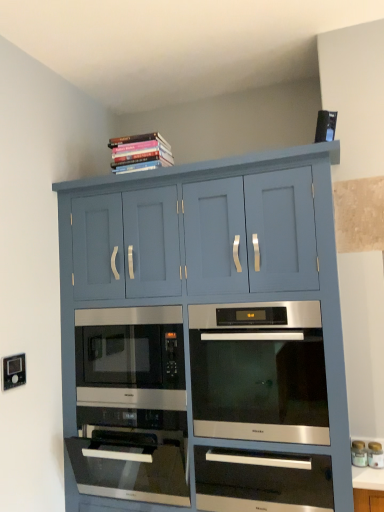
Question: Is white plastic electric outlet at lower left far from matte blue cabinet at upper center?

Choices:
 (A) no
 (B) yes

Answer: (A)

Question: Is white plastic electric outlet at lower left surrounding matte blue cabinet at upper center?

Choices:
 (A) no
 (B) yes

Answer: (A)

Question: Does white plastic electric outlet at lower left have a greater height compared to matte blue cabinet at upper center?

Choices:
 (A) no
 (B) yes

Answer: (A)

Question: Is white plastic electric outlet at lower left facing towards matte blue cabinet at upper center?

Choices:
 (A) no
 (B) yes

Answer: (A)

Question: Is white plastic electric outlet at lower left not inside matte blue cabinet at upper center?

Choices:
 (A) no
 (B) yes

Answer: (B)

Question: Is white plastic electric outlet at lower left to the left of matte blue cabinet at upper center from the viewer's perspective?

Choices:
 (A) no
 (B) yes

Answer: (B)

Question: Is matte blue cabinet at upper center turned away from white glossy jar at lower right, which is the 1th appliance from left to right?

Choices:
 (A) no
 (B) yes

Answer: (A)

Question: Is matte blue cabinet at upper center with white glossy jar at lower right, which is the 1th appliance from left to right?

Choices:
 (A) no
 (B) yes

Answer: (A)

Question: Is matte blue cabinet at upper center positioned in front of white glossy jar at lower right, which is the 1th appliance from left to right?

Choices:
 (A) no
 (B) yes

Answer: (B)

Question: Can you confirm if matte blue cabinet at upper center is thinner than white glossy jar at lower right, positioned as the 2th appliance in right-to-left order?

Choices:
 (A) no
 (B) yes

Answer: (A)

Question: Is matte blue cabinet at upper center shorter than white glossy jar at lower right, positioned as the 2th appliance in right-to-left order?

Choices:
 (A) yes
 (B) no

Answer: (B)

Question: Does matte blue cabinet at upper center contain white glossy jar at lower right, positioned as the 2th appliance in right-to-left order?

Choices:
 (A) yes
 (B) no

Answer: (A)

Question: Does white glossy jar at lower right, which is the 1th appliance from left to right, come behind satin silver drawer at center?

Choices:
 (A) no
 (B) yes

Answer: (B)